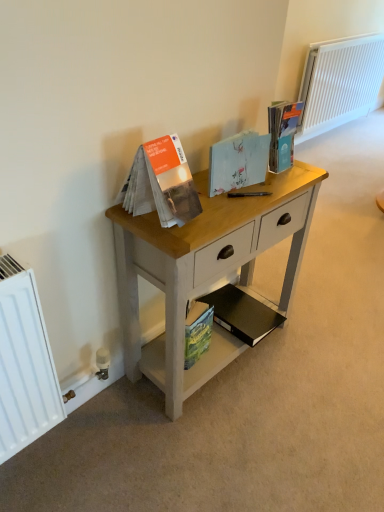
At what (x,y) coordinates should I click in order to perform the action: click on free spot in front of light blue paper at center, the third paperback book positioned from the bottom. Please return your answer as a coordinate pair (x, y). Image resolution: width=384 pixels, height=512 pixels. Looking at the image, I should click on (231, 209).